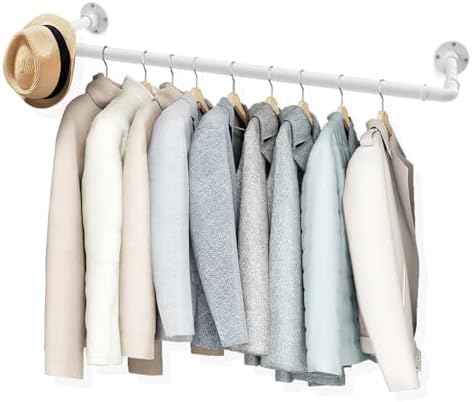
The height and width of the screenshot is (402, 472). I want to click on wire hook on coat hanger, so click(x=379, y=90), click(x=339, y=81), click(x=298, y=76), click(x=269, y=71), click(x=229, y=71), click(x=193, y=60), click(x=169, y=61), click(x=143, y=59), click(x=105, y=48).